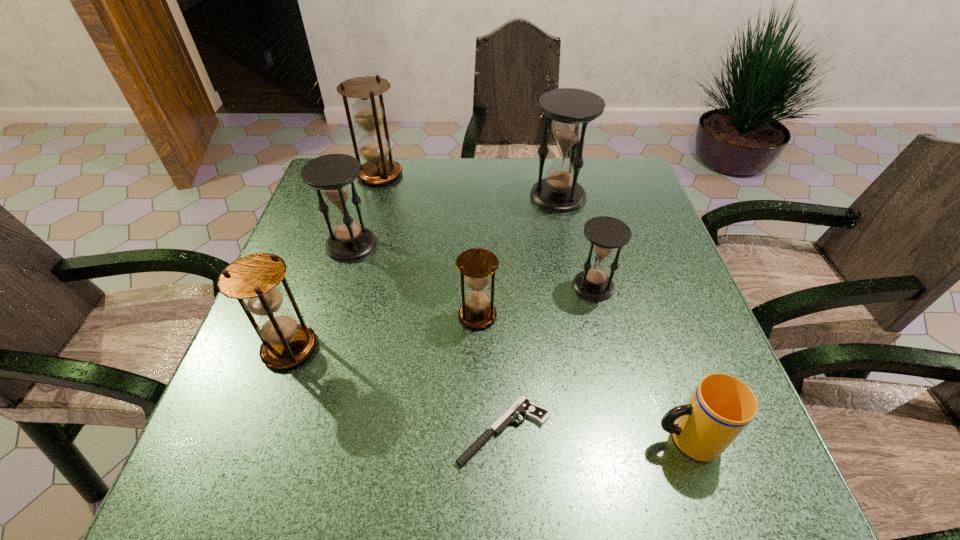
Identify the location of the biggest black hourglass. (571, 109).

What are the coordinates of `the biggest brown hourglass` in the screenshot? It's located at pyautogui.click(x=374, y=147).

Find the location of a particular element. the second farthest black hourglass is located at coordinates (332, 175).

In order to click on the leftmost black hourglass in this screenshot , I will do `click(332, 175)`.

At what (x,y) coordinates should I click in order to perform the action: click on the second biggest brown hourglass. Please return your answer as a coordinate pair (x, y). This screenshot has width=960, height=540. Looking at the image, I should click on (253, 280).

The image size is (960, 540). I want to click on the smallest black hourglass, so click(x=605, y=233).

The image size is (960, 540). Find the location of `the fourth hourglass from left to right`. the fourth hourglass from left to right is located at coordinates click(477, 264).

Find the location of a particular element. the rightmost brown hourglass is located at coordinates (477, 264).

Locate an element on the screen. beige cup is located at coordinates (721, 407).

You are a GUI agent. You are given a task and a screenshot of the screen. Output one action in this format:
    pyautogui.click(x=<x>, y=<y>)
    Task: Click on the second shortest object
    
    Given the screenshot: What is the action you would take?
    pyautogui.click(x=721, y=407)